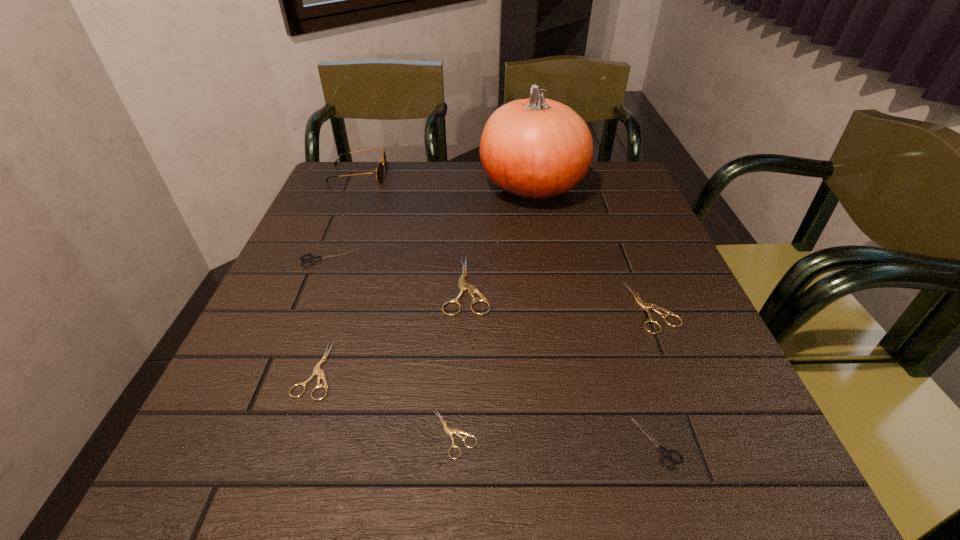
I want to click on free space between the nearest beige shears and the tallest object, so click(493, 310).

In order to click on free space between the sunglasses and the biggest beige shears in this screenshot , I will do `click(413, 230)`.

Find the location of a particular element. This screenshot has width=960, height=540. vacant space that is in between the pumpkin and the bigger black shears is located at coordinates (429, 222).

Locate an element on the screen. This screenshot has height=540, width=960. vacant point located between the rightmost beige shears and the bigger black shears is located at coordinates [489, 282].

The width and height of the screenshot is (960, 540). I want to click on free area in between the shortest object and the sunglasses, so click(406, 304).

Find the location of a particular element. The width and height of the screenshot is (960, 540). blank region between the orange pumpkin and the biggest beige shears is located at coordinates (499, 236).

The width and height of the screenshot is (960, 540). Find the location of `object that stands as the sixth closest to the nearest beige shears`. object that stands as the sixth closest to the nearest beige shears is located at coordinates (536, 149).

Point out which object is positioned as the seventh nearest to the orange pumpkin. Please provide its 2D coordinates. Your answer should be formatted as a tuple, i.e. [(x, y)], where the tuple contains the x and y coordinates of a point satisfying the conditions above.

[(666, 453)]

Identify the location of shears that is the third closest to the farther black shears. Image resolution: width=960 pixels, height=540 pixels. (449, 431).

The height and width of the screenshot is (540, 960). I want to click on shears identified as the fifth closest to the pumpkin, so click(x=449, y=431).